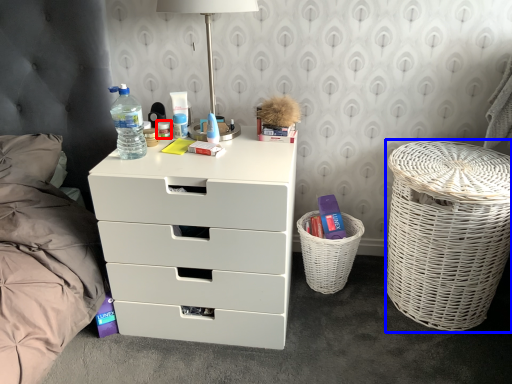
Question: Among these objects, which one is nearest to the camera, toiletry (highlighted by a red box) or laundry basket (highlighted by a blue box)?

Choices:
 (A) toiletry
 (B) laundry basket

Answer: (B)